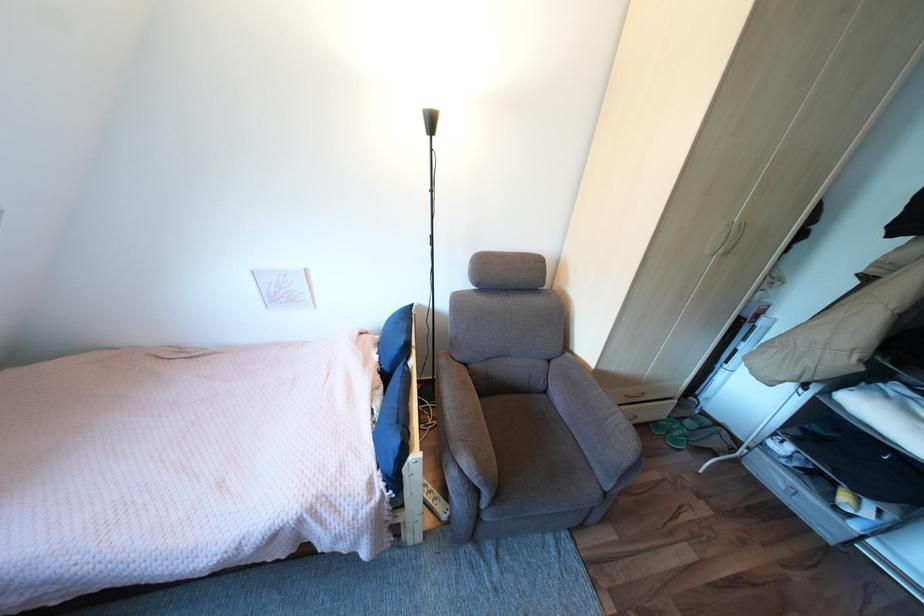
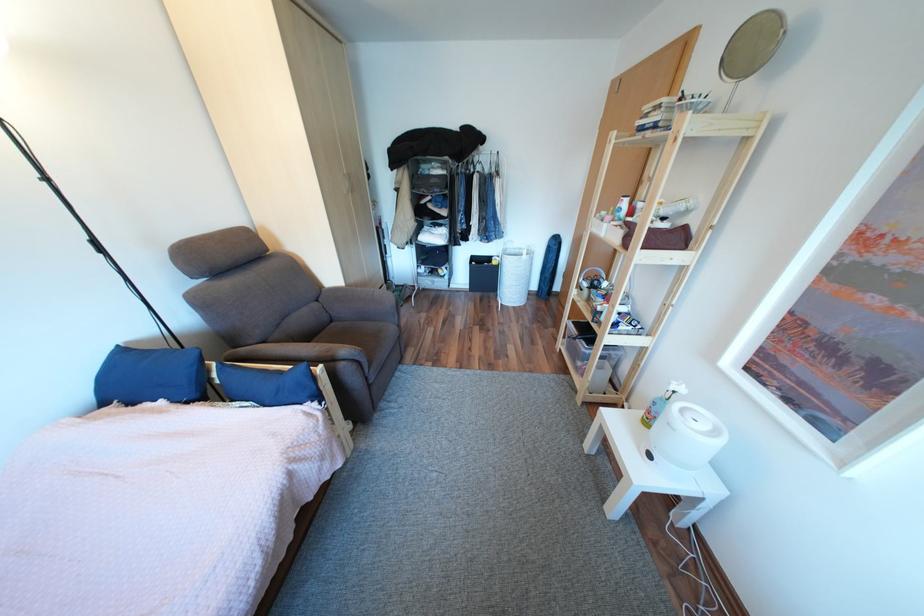
In the second image, find the point that corresponds to point (560, 361) in the first image.

(329, 301)